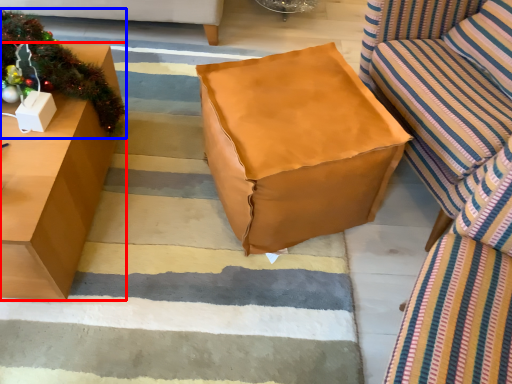
Question: Which object appears closest to the camera in this image, table (highlighted by a red box) or christmas decoration (highlighted by a blue box)?

Choices:
 (A) table
 (B) christmas decoration

Answer: (A)